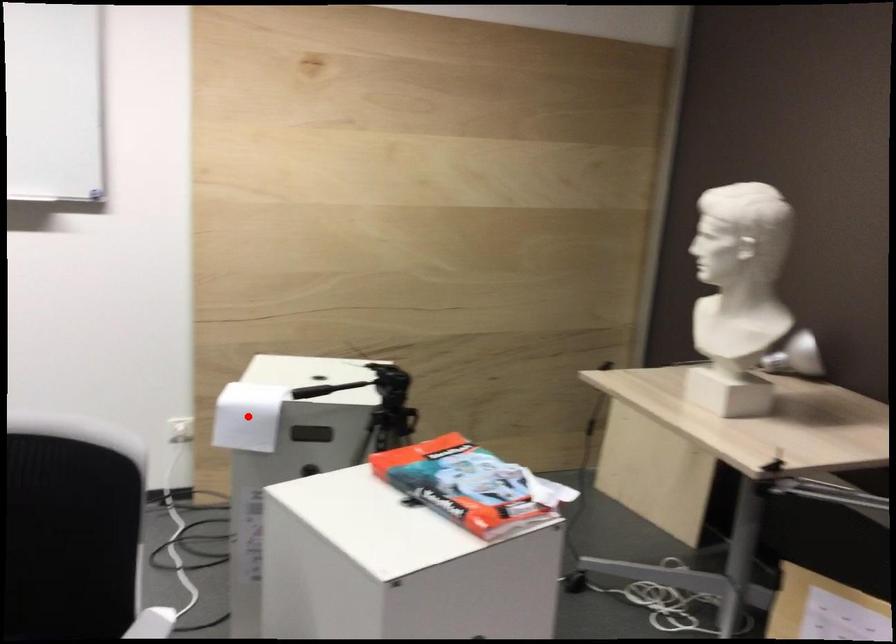
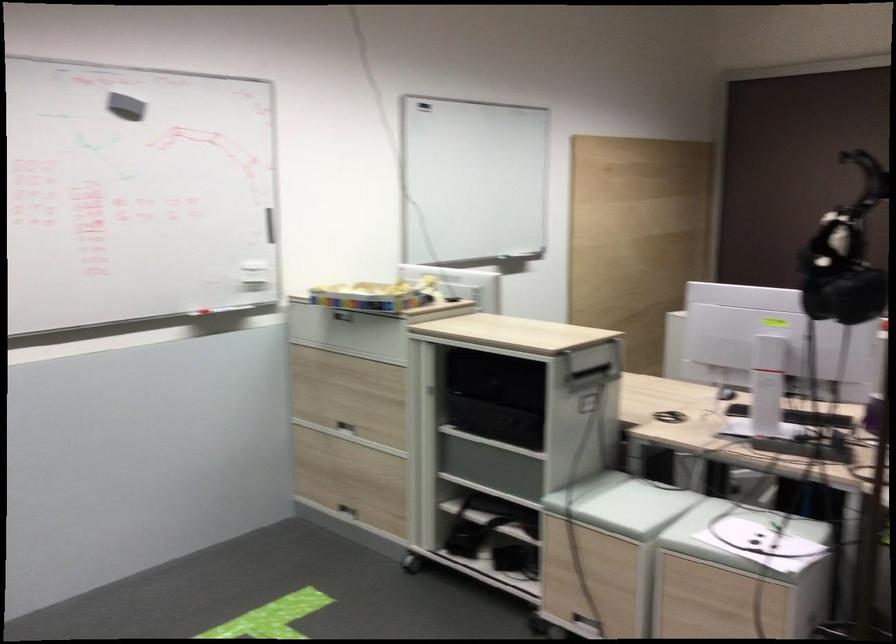
Question: I am providing you with two images of the same scene from different viewpoints. A red point is marked on the first image. Is the red point's position out of view in image 2?

Choices:
 (A) Yes
 (B) No

Answer: (A)